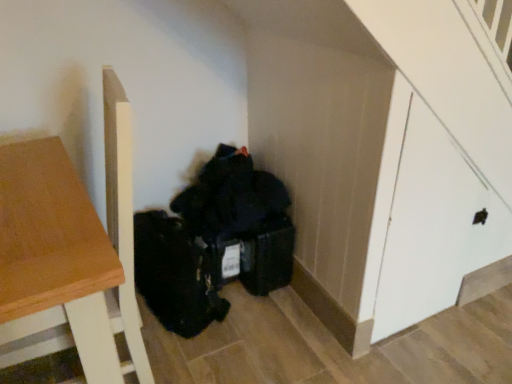
Identify the location of empty space that is ontop of white matte door at right. (468, 63).